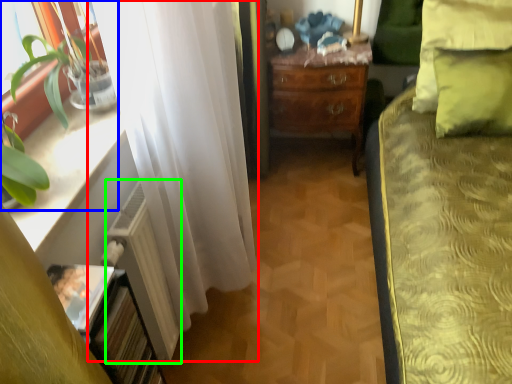
Question: Based on their relative distances, which object is nearer to curtain (highlighted by a red box)? Choose from houseplant (highlighted by a blue box) and radiator (highlighted by a green box).

Choices:
 (A) houseplant
 (B) radiator

Answer: (B)